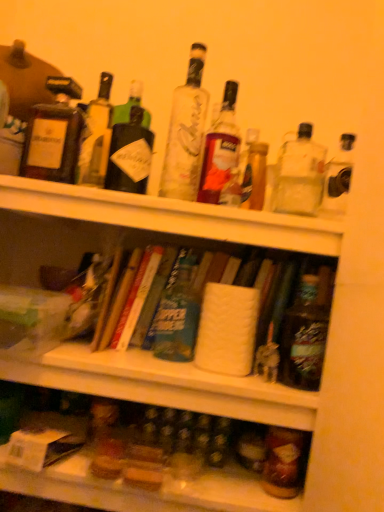
Question: Which direction should I rotate to look at translucent glass bottle at center, which appears as the 5th bottle when viewed from the left?

Choices:
 (A) right
 (B) left

Answer: (A)

Question: Can you confirm if shiny metallic bottle at center, the 9th bottle positioned from the left, is thinner than translucent glass bottle at center, placed as the fifth bottle when sorted from right to left?

Choices:
 (A) no
 (B) yes

Answer: (A)

Question: Is the depth of shiny metallic bottle at center, the 9th bottle positioned from the left, less than that of translucent glass bottle at center, which appears as the 5th bottle when viewed from the left?

Choices:
 (A) no
 (B) yes

Answer: (B)

Question: Is translucent glass bottle at center, placed as the fifth bottle when sorted from right to left, completely or partially inside shiny metallic bottle at center, marked as the 1th bottle in a right-to-left arrangement?

Choices:
 (A) yes
 (B) no

Answer: (B)

Question: Does shiny metallic bottle at center, marked as the 1th bottle in a right-to-left arrangement, have a greater width compared to translucent glass bottle at center, which appears as the 5th bottle when viewed from the left?

Choices:
 (A) no
 (B) yes

Answer: (B)

Question: Is shiny metallic bottle at center, marked as the 1th bottle in a right-to-left arrangement, aimed at translucent glass bottle at center, which appears as the 5th bottle when viewed from the left?

Choices:
 (A) yes
 (B) no

Answer: (B)

Question: Is shiny metallic bottle at center, the 9th bottle positioned from the left, smaller than translucent glass bottle at center, which appears as the 5th bottle when viewed from the left?

Choices:
 (A) yes
 (B) no

Answer: (B)

Question: From the image's perspective, is matte brown bottle at upper left, which is the ninth bottle in right-to-left order, beneath clear glass bottle at upper right, the second bottle viewed from the right?

Choices:
 (A) no
 (B) yes

Answer: (A)

Question: Is clear glass bottle at upper right, the 8th bottle viewed from the left, located within matte brown bottle at upper left, which is the 1th bottle from left to right?

Choices:
 (A) yes
 (B) no

Answer: (B)

Question: Is matte brown bottle at upper left, which is the ninth bottle in right-to-left order, facing away from clear glass bottle at upper right, the 8th bottle viewed from the left?

Choices:
 (A) no
 (B) yes

Answer: (A)

Question: Is matte brown bottle at upper left, which is the ninth bottle in right-to-left order, wider than clear glass bottle at upper right, the second bottle viewed from the right?

Choices:
 (A) no
 (B) yes

Answer: (A)

Question: Is the surface of matte brown bottle at upper left, which is the 1th bottle from left to right, in direct contact with clear glass bottle at upper right, the 8th bottle viewed from the left?

Choices:
 (A) yes
 (B) no

Answer: (B)

Question: Can you confirm if matte brown bottle at upper left, which is the 1th bottle from left to right, is smaller than clear glass bottle at upper right, the 8th bottle viewed from the left?

Choices:
 (A) yes
 (B) no

Answer: (A)

Question: Is matte brown bottle at upper left, which is the 1th bottle from left to right, wider than translucent glass bottle at lower right, marked as the 7th bottle in a left-to-right arrangement?

Choices:
 (A) no
 (B) yes

Answer: (B)